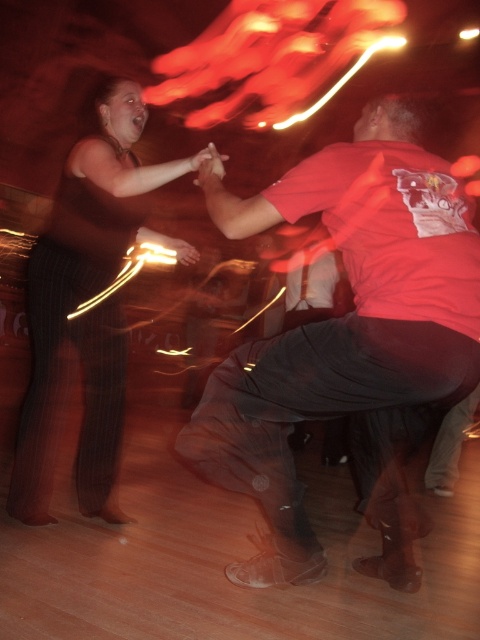
You are at a party and want to hand a drink to the person wearing the matte red shirt at center and the striped fabric pants at left. Which one can you reach first without moving your position?

The matte red shirt at center is closer to the viewer than the striped fabric pants at left, so you can reach the person wearing the matte red shirt at center first.